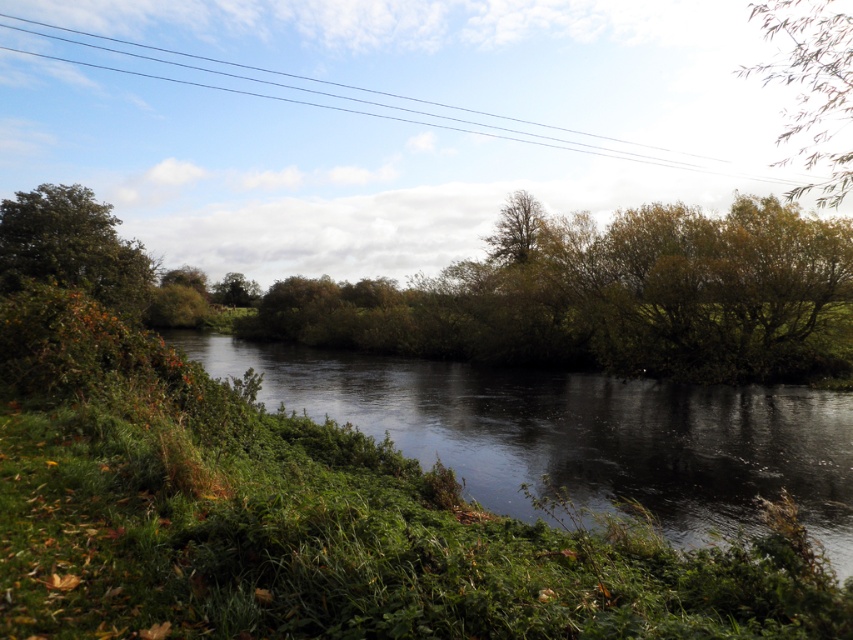
You are a photographer trying to capture the black wire at upper center and the green leafy tree at left in the same frame. Based on their widths, which object would appear wider in the photo?

The black wire at upper center would appear wider in the photo since its width surpasses that of the green leafy tree at left.